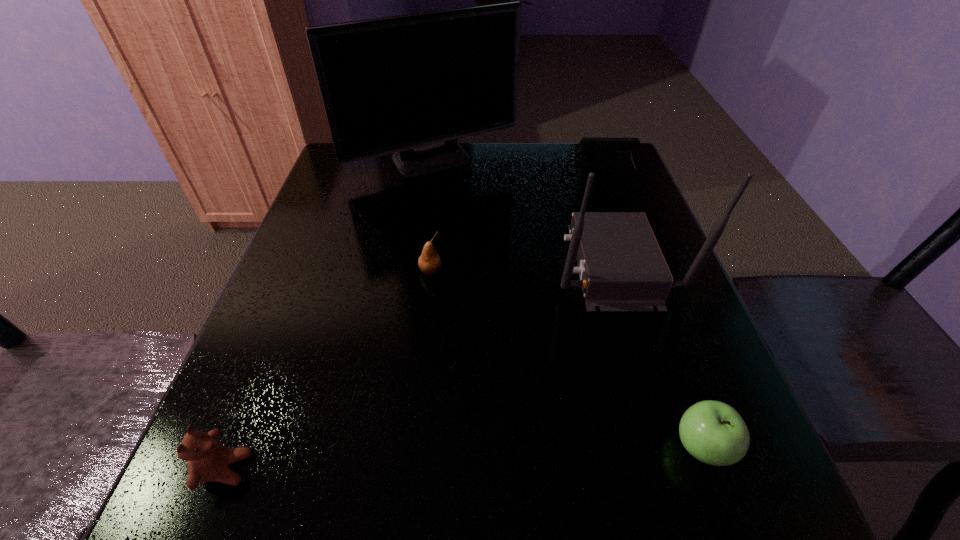
Locate an element on the screen. This screenshot has width=960, height=540. vacant position located 0.290m on the front-facing side of the pistol is located at coordinates (466, 174).

Where is `vacant area located 0.210m on the front-facing side of the pistol`? The image size is (960, 540). vacant area located 0.210m on the front-facing side of the pistol is located at coordinates (496, 174).

Locate an element on the screen. The image size is (960, 540). vacant space situated 0.110m on the front-facing side of the pistol is located at coordinates (534, 174).

I want to click on vacant region located on the left of the pear, so coord(337,271).

This screenshot has width=960, height=540. I want to click on vacant space situated on the face of the teddy bear, so click(x=382, y=469).

Where is `vacant area situated 0.340m on the back of the apple`? This screenshot has width=960, height=540. vacant area situated 0.340m on the back of the apple is located at coordinates (637, 268).

In order to click on computer monitor that is at the far edge in this screenshot , I will do `click(412, 84)`.

The image size is (960, 540). Identify the location of pistol located in the far edge section of the desktop. (621, 148).

Image resolution: width=960 pixels, height=540 pixels. What are the coordinates of `teddy bear located at the near edge` in the screenshot? It's located at (207, 459).

Locate an element on the screen. apple located in the near edge section of the desktop is located at coordinates (713, 432).